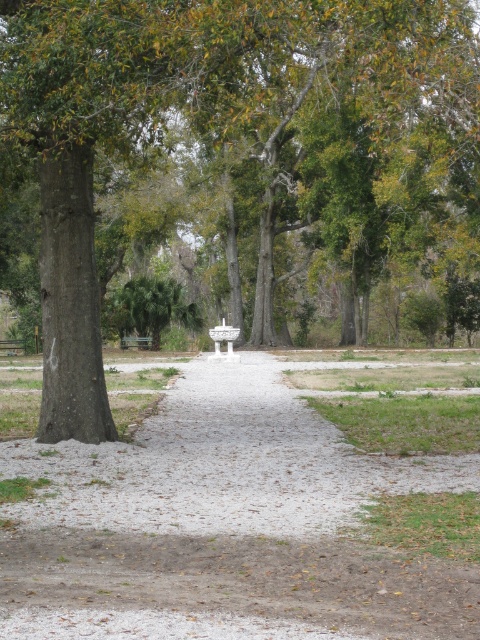
Question: Does brown rough tree at left have a greater width compared to wooden bench at center?

Choices:
 (A) yes
 (B) no

Answer: (A)

Question: Among these objects, which one is nearest to the camera?

Choices:
 (A) wooden bench at center
 (B) brown rough tree at left
 (C) gray gravel path at center

Answer: (C)

Question: Which of these objects is positioned farthest from the gray gravel path at center?

Choices:
 (A) brown rough tree at left
 (B) wooden bench at center

Answer: (B)

Question: Can you confirm if brown rough tree at left is bigger than wooden bench at center?

Choices:
 (A) no
 (B) yes

Answer: (B)

Question: Which of these objects is positioned closest to the gray gravel path at center?

Choices:
 (A) brown rough tree at left
 (B) wooden bench at center

Answer: (A)

Question: Observing the image, what is the correct spatial positioning of brown rough tree at left in reference to wooden bench at center?

Choices:
 (A) left
 (B) right

Answer: (B)